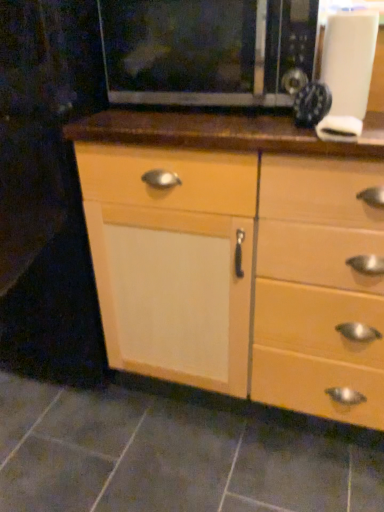
Question: Does gray tile at lower center have a lesser height compared to black matte microwave at upper center?

Choices:
 (A) yes
 (B) no

Answer: (A)

Question: Does gray tile at lower center have a larger size compared to black matte microwave at upper center?

Choices:
 (A) yes
 (B) no

Answer: (B)

Question: Are gray tile at lower center and black matte microwave at upper center beside each other?

Choices:
 (A) yes
 (B) no

Answer: (B)

Question: Is gray tile at lower center to the right of black matte microwave at upper center from the viewer's perspective?

Choices:
 (A) no
 (B) yes

Answer: (A)

Question: Is gray tile at lower center closer to the viewer compared to black matte microwave at upper center?

Choices:
 (A) yes
 (B) no

Answer: (A)

Question: From the image's perspective, is gray tile at lower center below black matte microwave at upper center?

Choices:
 (A) yes
 (B) no

Answer: (A)

Question: Is white matte knob at upper right wider than gray tile at lower center?

Choices:
 (A) no
 (B) yes

Answer: (A)

Question: Can we say white matte knob at upper right lies outside gray tile at lower center?

Choices:
 (A) yes
 (B) no

Answer: (A)

Question: Is white matte knob at upper right to the right of gray tile at lower center from the viewer's perspective?

Choices:
 (A) yes
 (B) no

Answer: (A)

Question: Does white matte knob at upper right lie behind gray tile at lower center?

Choices:
 (A) no
 (B) yes

Answer: (A)

Question: From the image's perspective, would you say white matte knob at upper right is positioned over gray tile at lower center?

Choices:
 (A) yes
 (B) no

Answer: (A)

Question: Is white matte knob at upper right facing away from gray tile at lower center?

Choices:
 (A) yes
 (B) no

Answer: (B)

Question: Is the position of white matte knob at upper right more distant than that of black matte microwave at upper center?

Choices:
 (A) no
 (B) yes

Answer: (A)